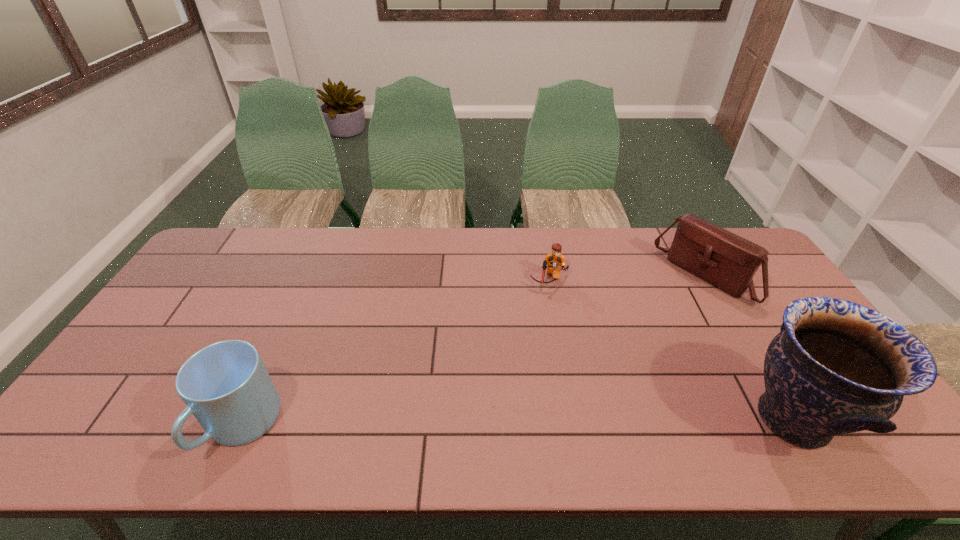
This screenshot has height=540, width=960. Find the location of `vacant space on the desktop that is between the mug and the pottery and is positioned holding a crossbow in the hands of the Lego`. vacant space on the desktop that is between the mug and the pottery and is positioned holding a crossbow in the hands of the Lego is located at coordinates (530, 422).

Image resolution: width=960 pixels, height=540 pixels. Identify the location of vacant spot on the desktop that is between the leftmost object and the pottery and is positioned on the front flap of the shoulder bag. (528, 422).